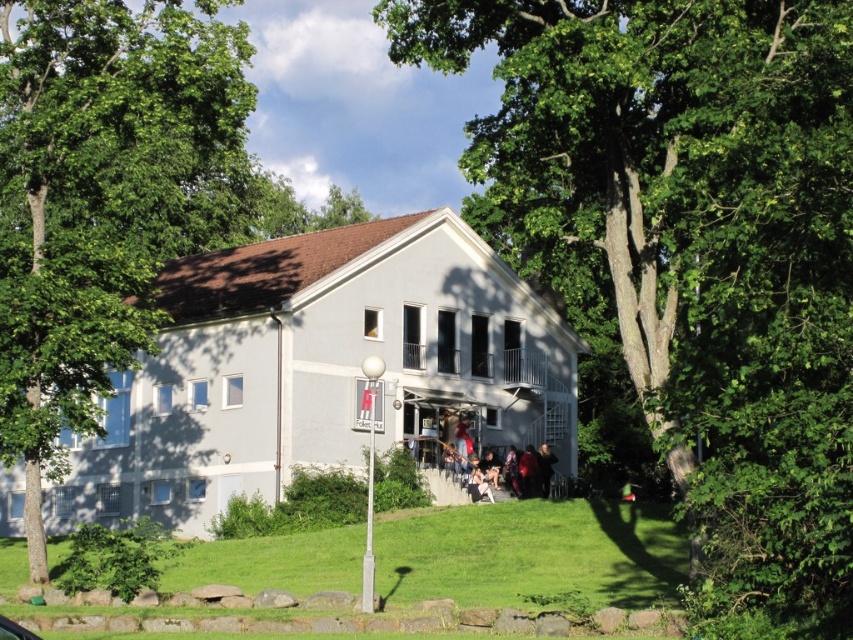
You are standing at the entrance of the house and want to walk to the green leafy tree at center. Which direction should you head towards?

The green leafy tree at center is located at point (695, 244), so you should head towards the center of the image to reach it.

You are standing at the point marked by the coordinates point (532, 554), which is on the green grass at lower center. Looking towards the house, which direction should you walk to reach the streetlamp in the foreground?

The point (532, 554) is on the green grass at lower center, and the streetlamp is in the foreground. Since the streetlamp is in the foreground, it is closer to the viewer. Therefore, to reach the streetlamp from the green grass at lower center, you should walk towards the direction of the streetlamp, which is likely towards the front of the image relative to your current position.